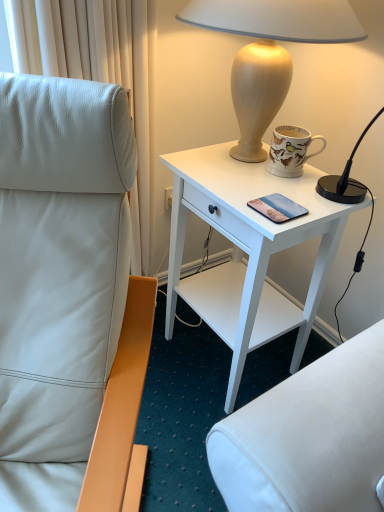
Question: Which is correct: matte glass mobile phone at center is inside porcelain mug with bird illustrations at upper right, or outside of it?

Choices:
 (A) inside
 (B) outside

Answer: (B)

Question: From a real-world perspective, is matte glass mobile phone at center physically located above or below porcelain mug with bird illustrations at upper right?

Choices:
 (A) above
 (B) below

Answer: (B)

Question: Which is nearer to the wooden lamp at upper right?

Choices:
 (A) white leather chair at left
 (B) white wood desk at upper right
 (C) matte glass mobile phone at center
 (D) porcelain mug with bird illustrations at upper right

Answer: (D)

Question: Which of these objects is positioned farthest from the matte glass mobile phone at center?

Choices:
 (A) porcelain mug with bird illustrations at upper right
 (B) white leather chair at left
 (C) wooden lamp at upper right
 (D) white wood desk at upper right

Answer: (B)